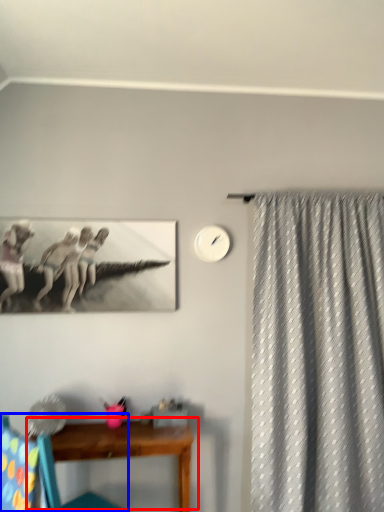
Question: Among these objects, which one is nearest to the camera, table (highlighted by a red box) or chair (highlighted by a blue box)?

Choices:
 (A) table
 (B) chair

Answer: (B)